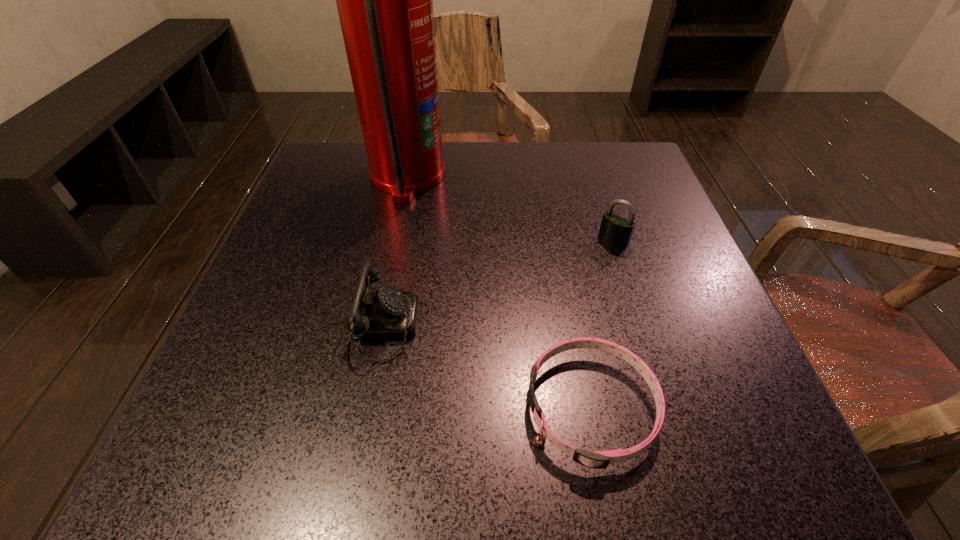
In the image, there is a desktop. At what (x,y) coordinates should I click in order to perform the action: click on vacant space at the near edge. Please return your answer as a coordinate pair (x, y). This screenshot has width=960, height=540. Looking at the image, I should click on (358, 424).

Where is `free space at the left edge of the desktop`? The width and height of the screenshot is (960, 540). free space at the left edge of the desktop is located at coordinates (230, 340).

Find the location of a particular element. The width and height of the screenshot is (960, 540). vacant region at the far left corner of the desktop is located at coordinates (328, 146).

The image size is (960, 540). What are the coordinates of `vacant region at the near left corner of the desktop` in the screenshot? It's located at (193, 415).

Where is `free spot between the telephone and the padlock`? Image resolution: width=960 pixels, height=540 pixels. free spot between the telephone and the padlock is located at coordinates (485, 278).

The image size is (960, 540). What are the coordinates of `vacant area that lies between the padlock and the dog collar` in the screenshot? It's located at (602, 324).

I want to click on vacant region between the shortest object and the telephone, so click(474, 362).

Where is `vacant area between the third nearest object and the fire extinguisher`? vacant area between the third nearest object and the fire extinguisher is located at coordinates (511, 208).

The height and width of the screenshot is (540, 960). I want to click on free space between the shortest object and the farthest object, so click(499, 293).

Locate an element on the screen. This screenshot has height=540, width=960. empty space that is in between the shortest object and the tallest object is located at coordinates (499, 293).